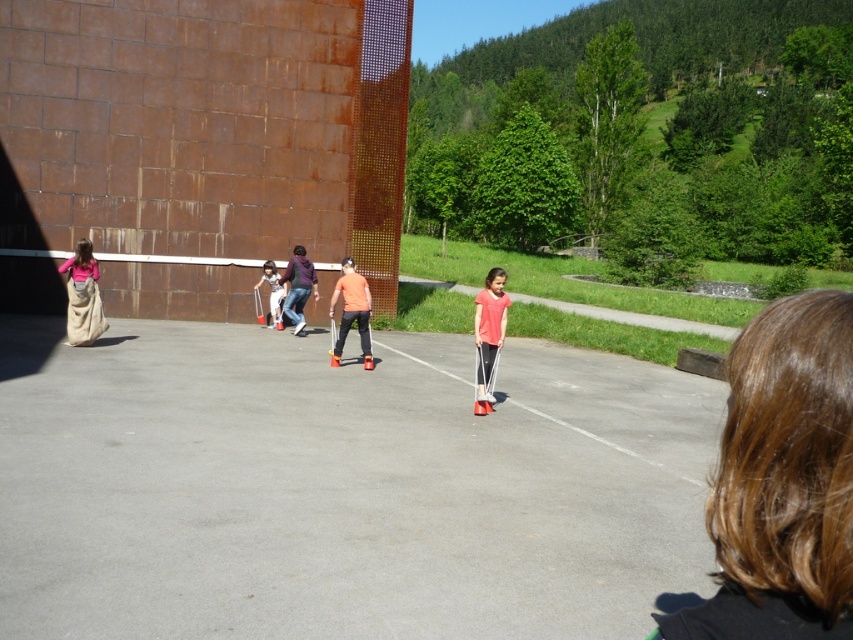
You are a photographer at the scene and want to place a tripod to capture the beige canvas sack at left. What are the coordinates where you should set up the tripod to ensure the sack is in the center of the photo?

The beige canvas sack at left is located at point (82, 296), so you should set up the tripod at those coordinates to center the sack in your photo.

You are standing at point (294, 284) and want to walk to point (360, 291). Which direction should you move in to reach your destination?

You should move forward because point (360, 291) is in front of point (294, 284).

You are a photographer trying to capture a clear shot of the orange matte shirt at center and the matte orange shirt at center. Since they are very similar in color, can you tell which one is in front based on their positions?

The orange matte shirt at center is positioned under the matte orange shirt at center, so the matte orange shirt at center is in front.